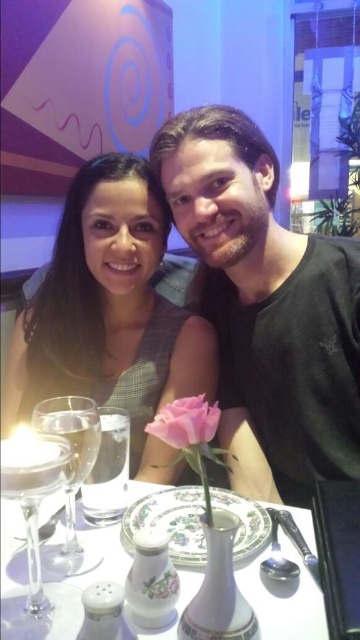
Where is the matte black dress at center located in the image?

The matte black dress at center is located at point coordinates of approximately 0.491 on the x axis and 0.308 on the y axis.

Consider the image. You are a photographer taking a picture of the dining table. You notice two points marked on the table. Which point is closer to the camera? The points are labeled as point (303, 532) and point (199, 410).

Point (303, 532) is closer to the camera because it is further to the viewer than point (199, 410).